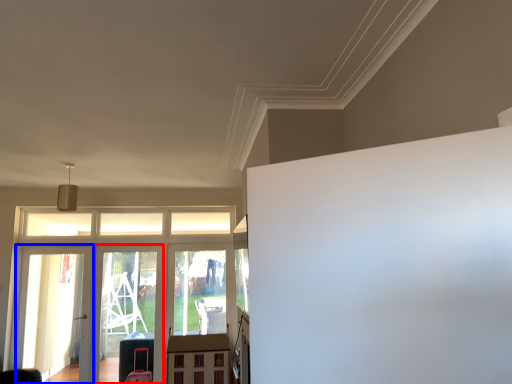
Question: Which of the following is the farthest to the observer, screen door (highlighted by a red box) or screen door (highlighted by a blue box)?

Choices:
 (A) screen door
 (B) screen door

Answer: (A)